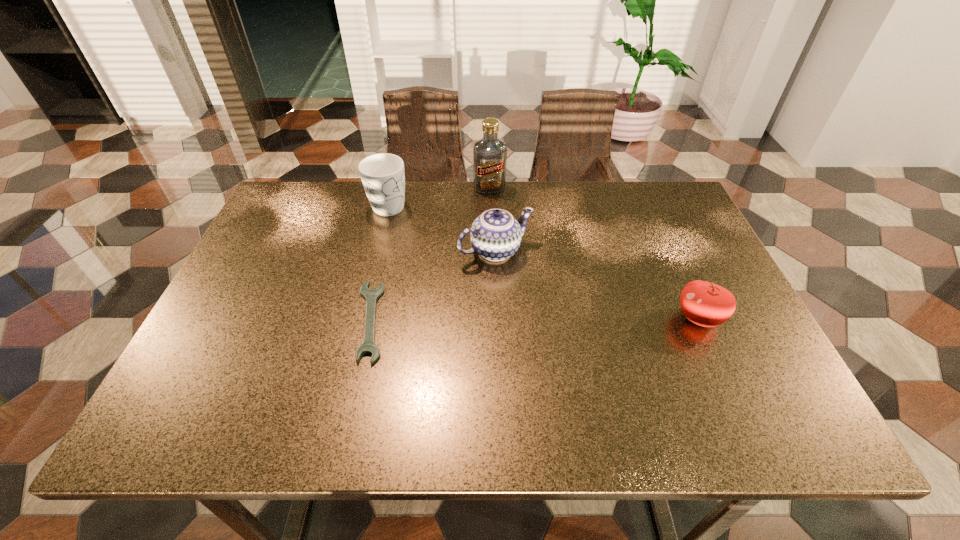
In order to click on vacant space located 0.070m at the spout of the third farthest object in this screenshot , I will do (528, 284).

Where is `vacant region located on the side of the mug with the handle`? vacant region located on the side of the mug with the handle is located at coordinates (473, 296).

Identify the location of vacant space located 0.340m on the side of the mug with the handle. point(465,286).

Identify the location of vacant space located on the side of the mug with the handle. (412, 232).

At what (x,y) coordinates should I click in order to perform the action: click on vacant space positioned 0.140m on the front-facing side of the vodka. Please return your answer as a coordinate pair (x, y). This screenshot has width=960, height=540. Looking at the image, I should click on (494, 222).

Where is `vacant region located on the front-facing side of the vodka`? The image size is (960, 540). vacant region located on the front-facing side of the vodka is located at coordinates (498, 247).

Find the location of a particular element. This screenshot has height=540, width=960. vacant space situated on the front-facing side of the vodka is located at coordinates (494, 220).

Locate an element on the screen. mug present at the far edge is located at coordinates (383, 177).

Where is `vodka that is at the far edge`? The width and height of the screenshot is (960, 540). vodka that is at the far edge is located at coordinates (489, 153).

Find the location of a particular element. The width and height of the screenshot is (960, 540). object present at the near edge is located at coordinates (368, 346).